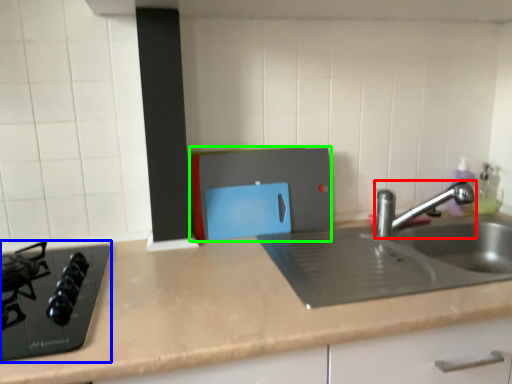
Question: Considering the real-world distances, which object is farthest from tap (highlighted by a red box)? gas stove (highlighted by a blue box) or appliance (highlighted by a green box)?

Choices:
 (A) gas stove
 (B) appliance

Answer: (A)